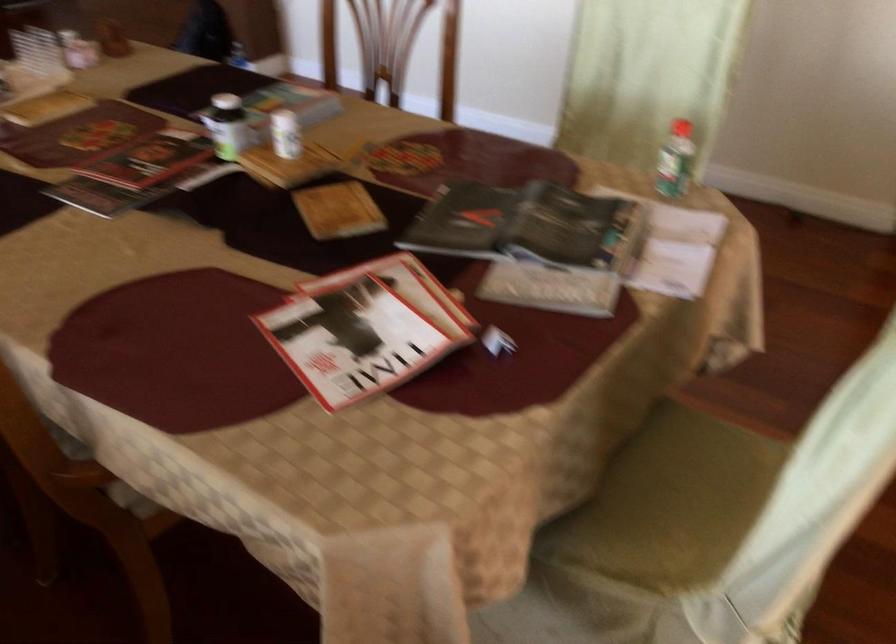
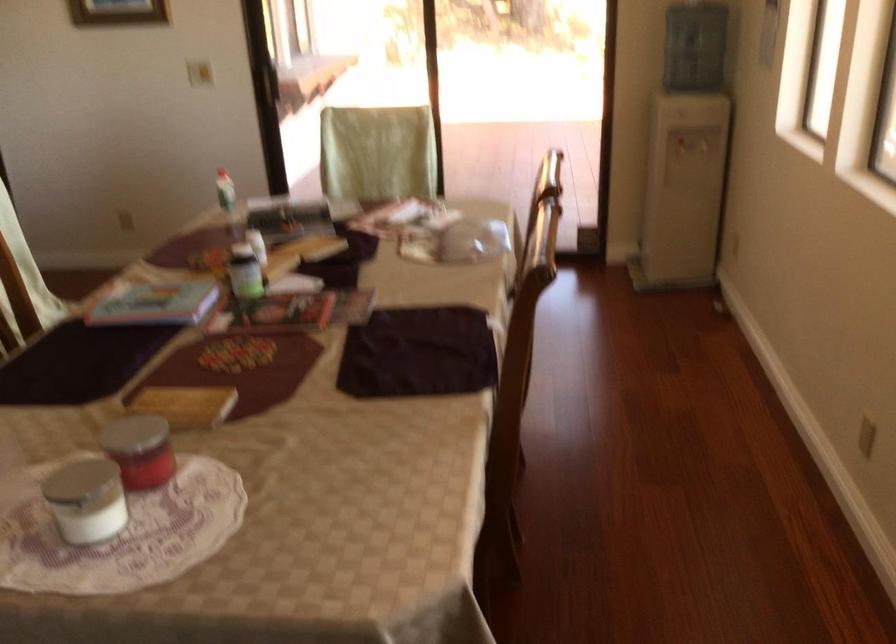
Find the pixel in the second image that matches pixel 234 122 in the first image.

(245, 272)